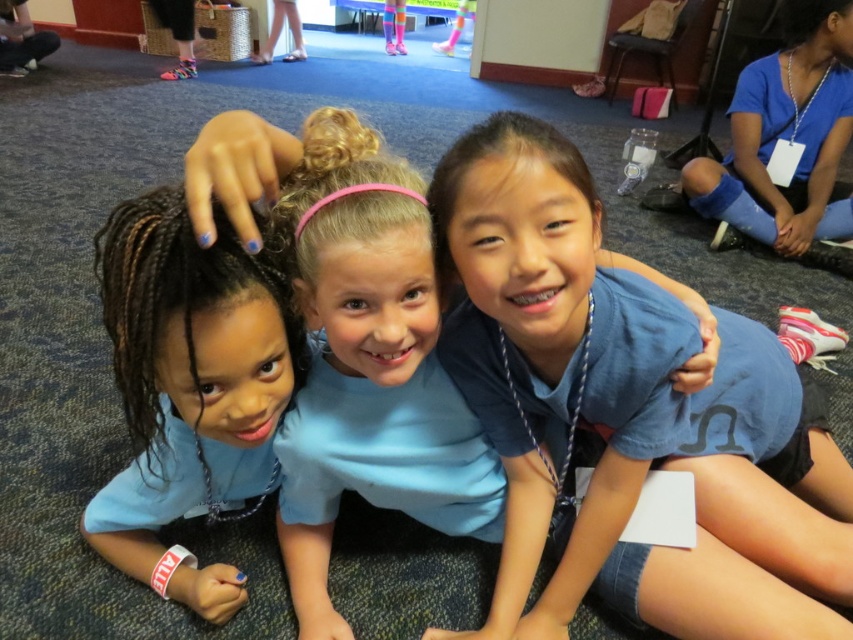
You are a photographer trying to capture a candid shot of the children. You notice the blue matte hair at center and the blue fabric leg at lower right. Which object is positioned lower in the image?

The blue matte hair at center is positioned below the blue fabric leg at lower right, so it is lower in the image.

You are a photographer trying to capture a candid shot of the children. Since the blue cotton shirt at center and the blue matte hair at center are both in the frame, which one is more likely to be visible from a lower angle?

The blue cotton shirt at center is taller than the blue matte hair at center, so it would be more visible from a lower angle.

You are a photographer trying to capture a candid shot of the children. You notice the blue cotton shirt at center and the blue fabric leg at lower right. Which object is located to the left of the other?

The blue cotton shirt at center is positioned on the left side of blue fabric leg at lower right, so the blue cotton shirt at center is to the left of the blue fabric leg at lower right.